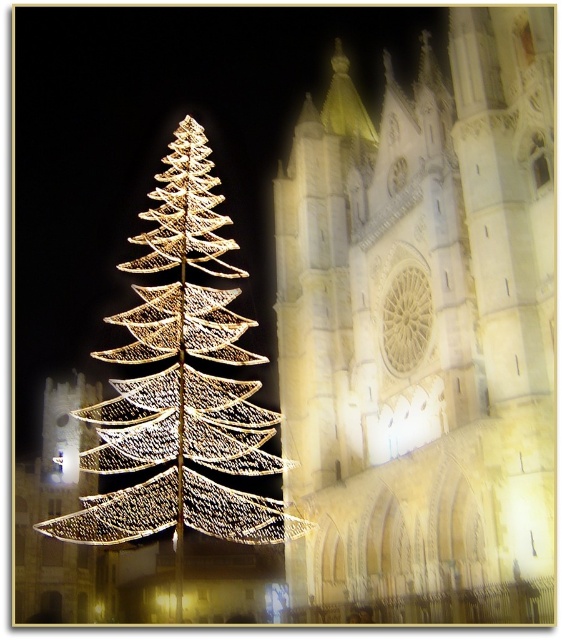
Question: Can you confirm if illuminated stone tower at center is positioned to the left of illuminated wireframe at left?

Choices:
 (A) yes
 (B) no

Answer: (B)

Question: Can you confirm if illuminated stone tower at center is bigger than illuminated wireframe at left?

Choices:
 (A) yes
 (B) no

Answer: (B)

Question: Does illuminated stone tower at center have a larger size compared to illuminated wireframe at left?

Choices:
 (A) no
 (B) yes

Answer: (A)

Question: Which point is farther to the camera?

Choices:
 (A) illuminated wireframe at left
 (B) illuminated stone tower at center

Answer: (A)

Question: Which of the following is the closest to the observer?

Choices:
 (A) illuminated stone tower at center
 (B) illuminated wireframe at left

Answer: (A)